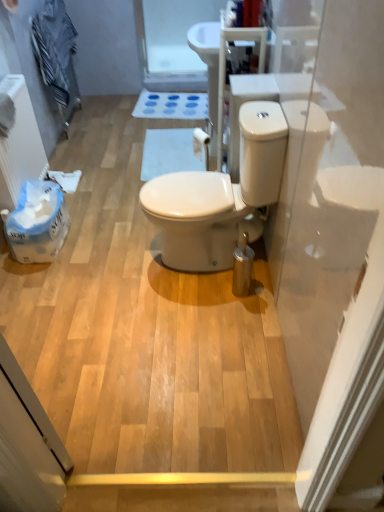
Question: Is transparent plastic screen door at upper center located outside white matte bath mat at center?

Choices:
 (A) yes
 (B) no

Answer: (A)

Question: Is white matte bath mat at center completely or partially inside transparent plastic screen door at upper center?

Choices:
 (A) no
 (B) yes

Answer: (A)

Question: Does transparent plastic screen door at upper center turn towards white matte bath mat at center?

Choices:
 (A) yes
 (B) no

Answer: (A)

Question: From a real-world perspective, is transparent plastic screen door at upper center over white matte bath mat at center?

Choices:
 (A) yes
 (B) no

Answer: (A)

Question: Can you confirm if transparent plastic screen door at upper center is shorter than white matte bath mat at center?

Choices:
 (A) yes
 (B) no

Answer: (B)

Question: Is transparent plastic screen door at upper center looking in the opposite direction of white matte bath mat at center?

Choices:
 (A) yes
 (B) no

Answer: (B)

Question: From a real-world perspective, is white matte bath mat at center positioned over transparent plastic screen door at upper center based on gravity?

Choices:
 (A) yes
 (B) no

Answer: (B)

Question: Can you confirm if white matte bath mat at center is positioned to the left of transparent plastic screen door at upper center?

Choices:
 (A) no
 (B) yes

Answer: (B)

Question: Is white matte bath mat at center smaller than transparent plastic screen door at upper center?

Choices:
 (A) yes
 (B) no

Answer: (A)

Question: Is transparent plastic screen door at upper center at the back of white matte bath mat at center?

Choices:
 (A) yes
 (B) no

Answer: (B)

Question: Is white matte bath mat at center completely or partially outside of transparent plastic screen door at upper center?

Choices:
 (A) no
 (B) yes

Answer: (B)

Question: From the image's perspective, is white matte bath mat at center over transparent plastic screen door at upper center?

Choices:
 (A) no
 (B) yes

Answer: (A)

Question: From the image's perspective, is white matte bath mat at center below striped cotton towel at upper left?

Choices:
 (A) no
 (B) yes

Answer: (B)